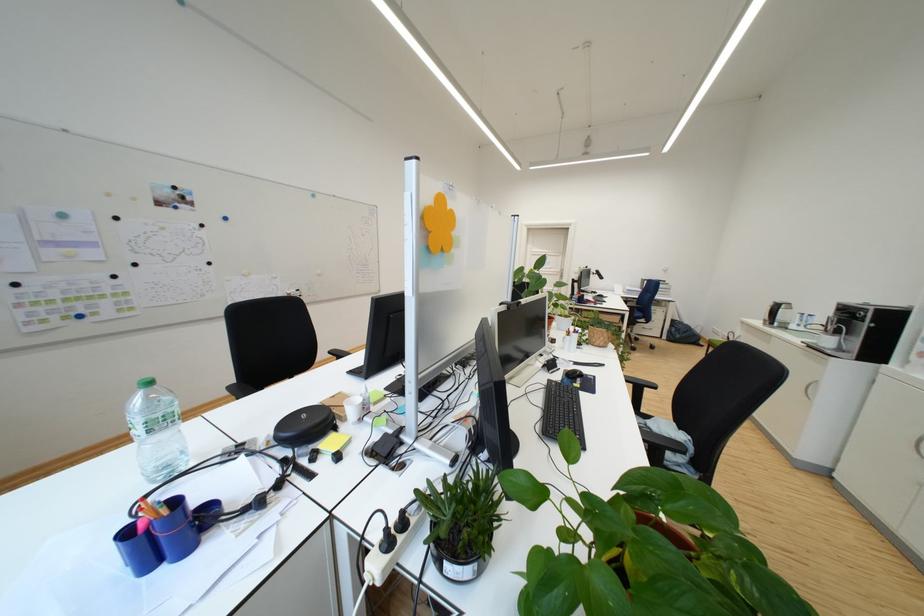
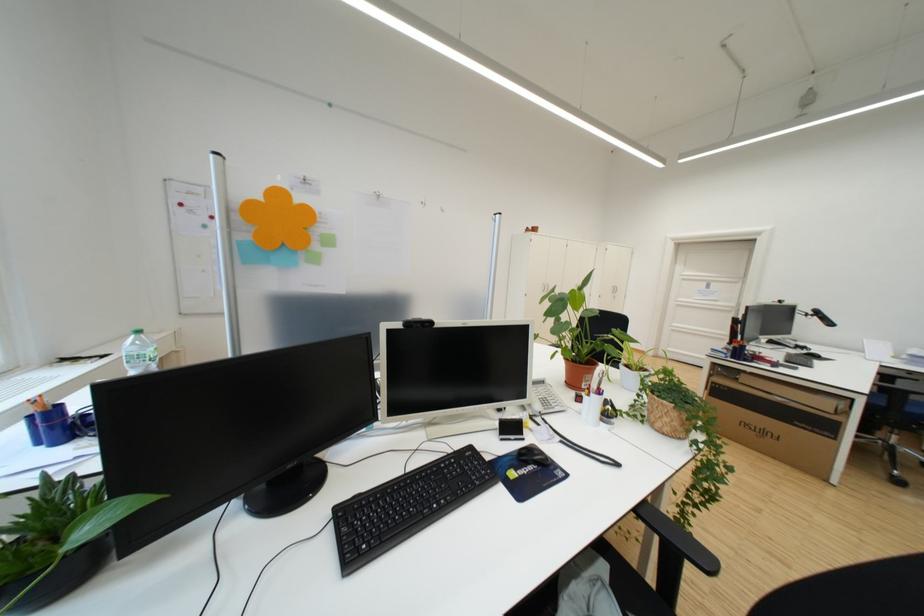
Locate, in the second image, the point that corresponds to the point at 659,392 in the first image.

(700, 567)